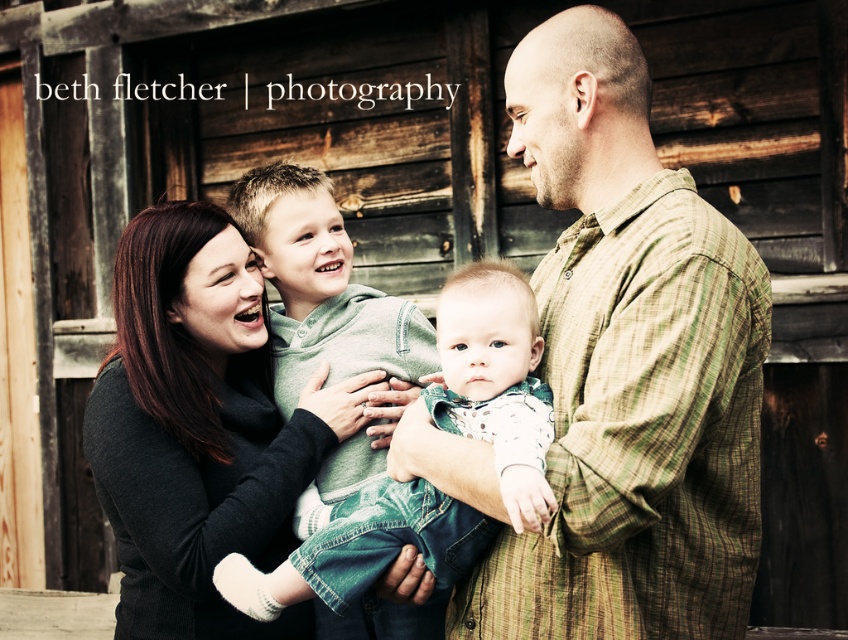
Question: Is green plaid shirt at center below soft white knit sweater at center?

Choices:
 (A) yes
 (B) no

Answer: (B)

Question: Can you confirm if green plaid shirt at center is smaller than matte black sweater at center?

Choices:
 (A) no
 (B) yes

Answer: (A)

Question: Which of the following is the farthest from the observer?

Choices:
 (A) (444, 540)
 (B) (233, 481)

Answer: (B)

Question: Which object is farther from the camera taking this photo?

Choices:
 (A) soft white knit sweater at center
 (B) matte black sweater at center

Answer: (B)

Question: Which object is farther from the camera taking this photo?

Choices:
 (A) green plaid shirt at center
 (B) soft white knit sweater at center

Answer: (A)

Question: Is the position of green plaid shirt at center less distant than that of matte black sweater at center?

Choices:
 (A) yes
 (B) no

Answer: (A)